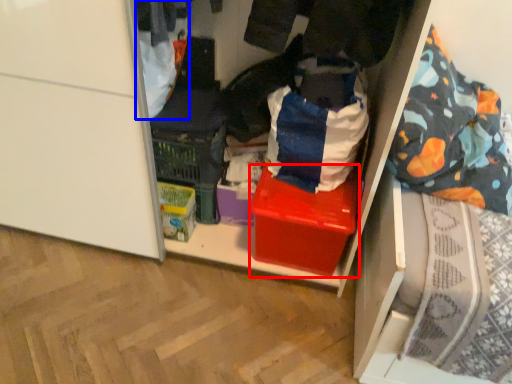
Question: Which point is closer to the camera, box (highlighted by a red box) or clothing (highlighted by a blue box)?

Choices:
 (A) box
 (B) clothing

Answer: (B)